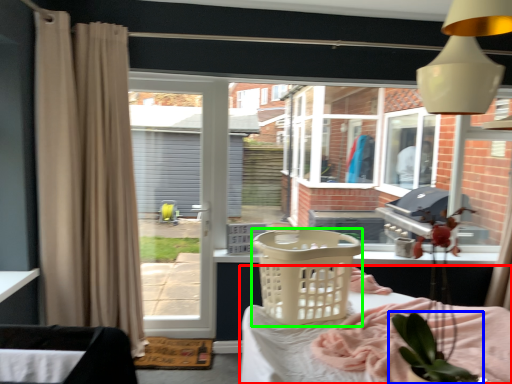
Question: Which object is positioned closest to furniture (highlighted by a red box)? Select from houseplant (highlighted by a blue box) and basket (highlighted by a green box).

Choices:
 (A) houseplant
 (B) basket

Answer: (B)